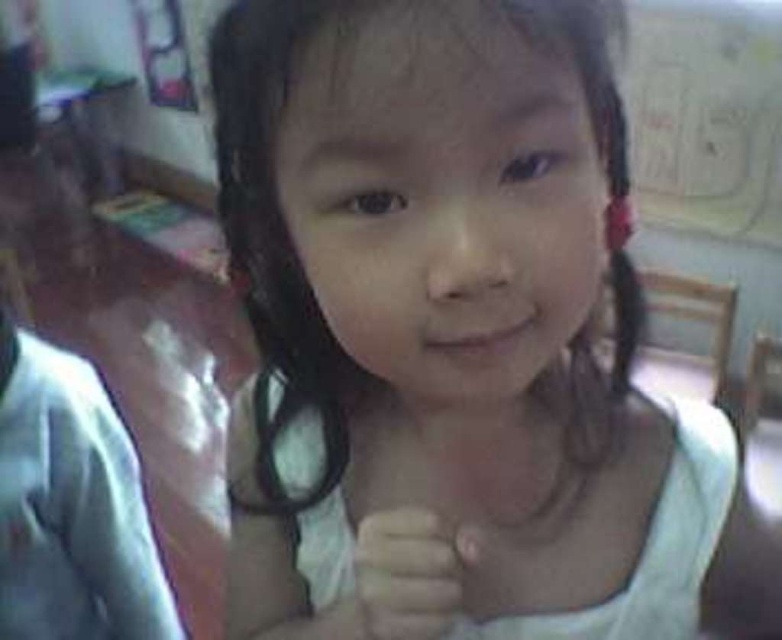
Who is lower down, white fabric child at center or white matte hand at center?

white fabric child at center

Can you confirm if white fabric child at center is wider than white matte hand at center?

Yes, white fabric child at center is wider than white matte hand at center.

This screenshot has width=782, height=640. In order to click on white fabric child at center in this screenshot , I will do (x=457, y=330).

Locate an element on the screen. This screenshot has height=640, width=782. white fabric child at center is located at coordinates (457, 330).

Which is behind, point (497, 634) or point (372, 528)?

Point (497, 634)

Is point (641, 561) farther from camera compared to point (415, 554)?

Yes, it is behind point (415, 554).

Find the location of a particular element. white fabric dress at center is located at coordinates (653, 547).

Is white fabric child at center closer to camera compared to white fabric dress at center?

Yes.

In the scene shown: Which is more to the left, white fabric child at center or white fabric dress at center?

From the viewer's perspective, white fabric dress at center appears more on the left side.

Locate an element on the screen. Image resolution: width=782 pixels, height=640 pixels. white fabric child at center is located at coordinates (457, 330).